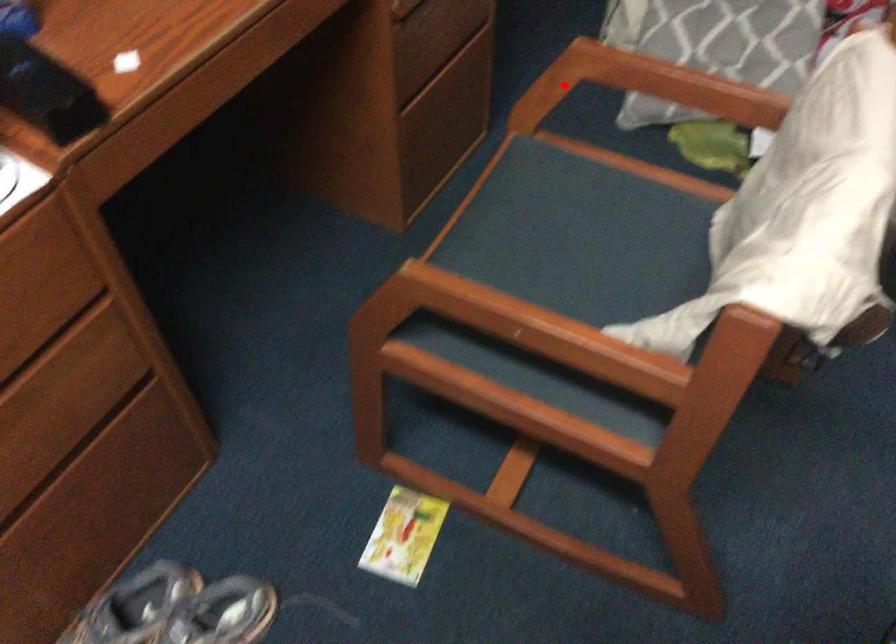
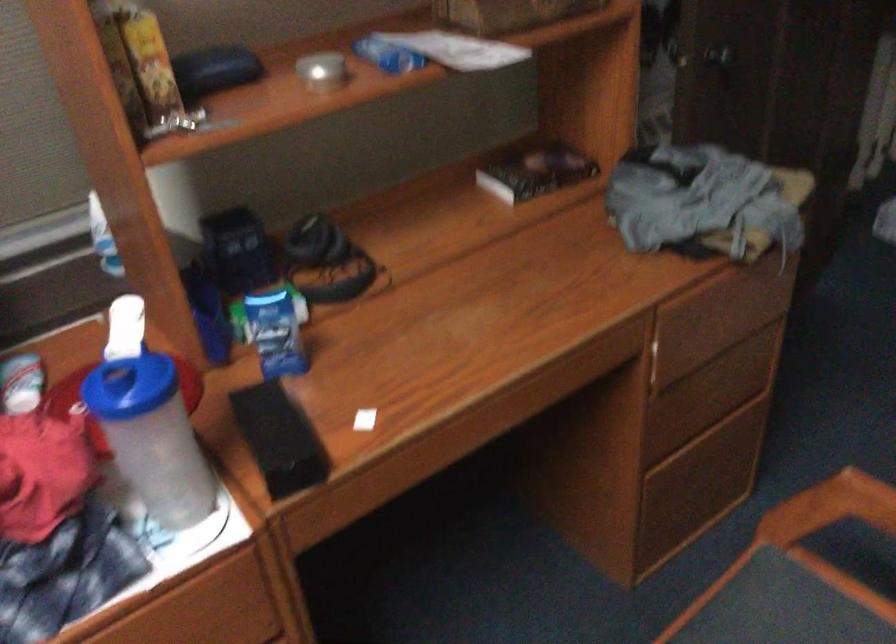
Question: I am providing you with two images of the same scene from different viewpoints. Given a red point in image1, look at the same physical point in image2. Is it:

Choices:
 (A) Closer to the viewpoint
 (B) Farther from the viewpoint

Answer: (A)